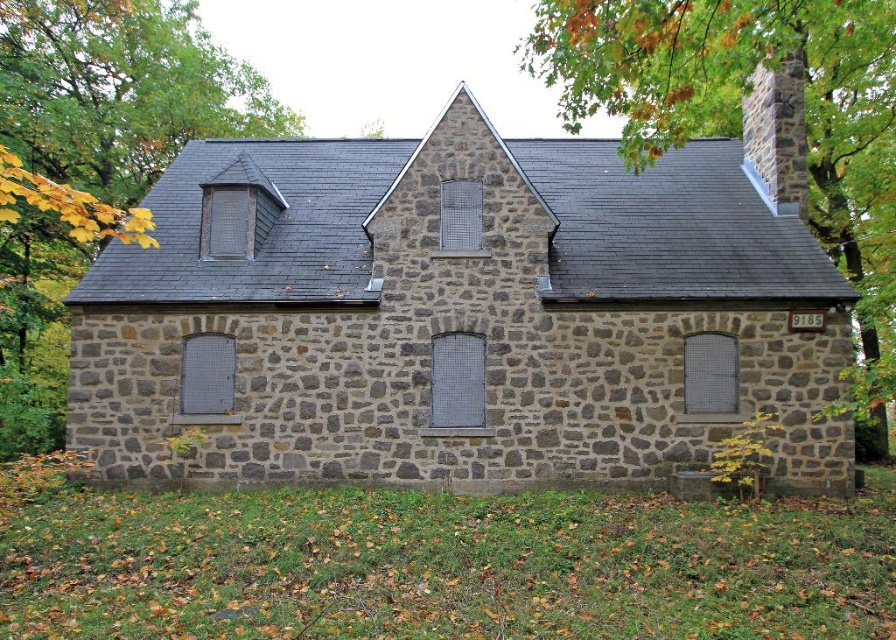
You are a landscape architect planning to add a new pathway leading to the gray stone chapel at center. Considering the green leafy tree at upper right, which structure is wider so that you can design the path accordingly?

The gray stone chapel at center is wider than the green leafy tree at upper right, so the pathway should be designed to accommodate the chapel width.

You are a gardener planning to trim the green leafy tree at upper right and the stone chimney at upper right. Based on their sizes, which one might require a taller ladder?

The green leafy tree at upper right is larger than the stone chimney at upper right, so you would need a taller ladder for the green leafy tree at upper right.